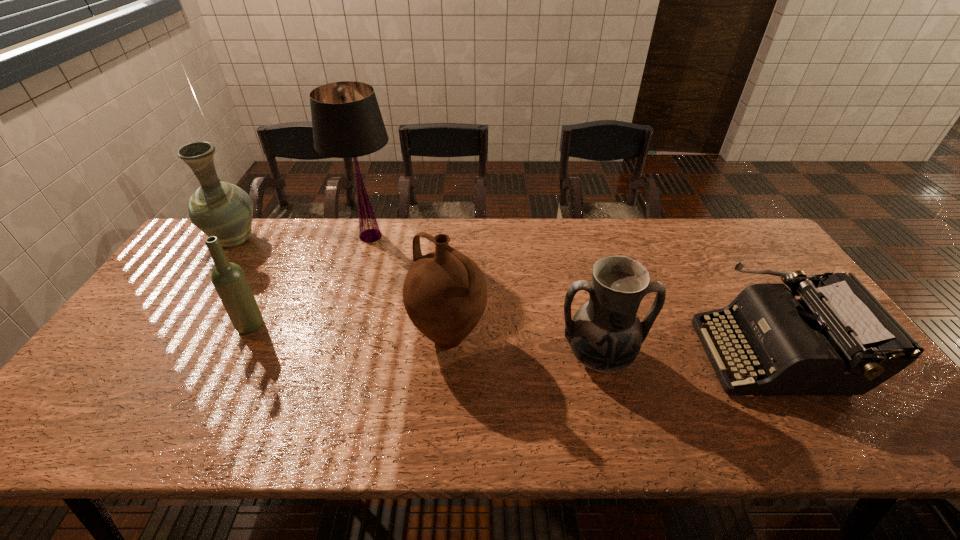
Locate an element on the screen. The image size is (960, 540). the fourth object from right to left is located at coordinates (347, 123).

Find the location of a particular element. The height and width of the screenshot is (540, 960). the tallest object is located at coordinates (347, 123).

This screenshot has width=960, height=540. Identify the location of the leftmost object. (217, 208).

Identify the location of the farthest pitcher. (217, 208).

The height and width of the screenshot is (540, 960). I want to click on the fourth object from left to right, so click(x=445, y=293).

Find the location of a particular element. This screenshot has width=960, height=540. the fifth object from right to left is located at coordinates (229, 280).

You are a GUI agent. You are given a task and a screenshot of the screen. Output one action in this format:
    pyautogui.click(x=<x>, y=<y>)
    Task: Click on the rightmost pitcher
    This screenshot has height=540, width=960.
    Given the screenshot: What is the action you would take?
    pyautogui.click(x=605, y=335)

Identify the location of typewriter. This screenshot has width=960, height=540. (837, 339).

Where is `the rightmost object`? the rightmost object is located at coordinates 837,339.

This screenshot has width=960, height=540. In order to click on blank space located 0.220m on the front-facing side of the lampshade in this screenshot , I will do `click(349, 305)`.